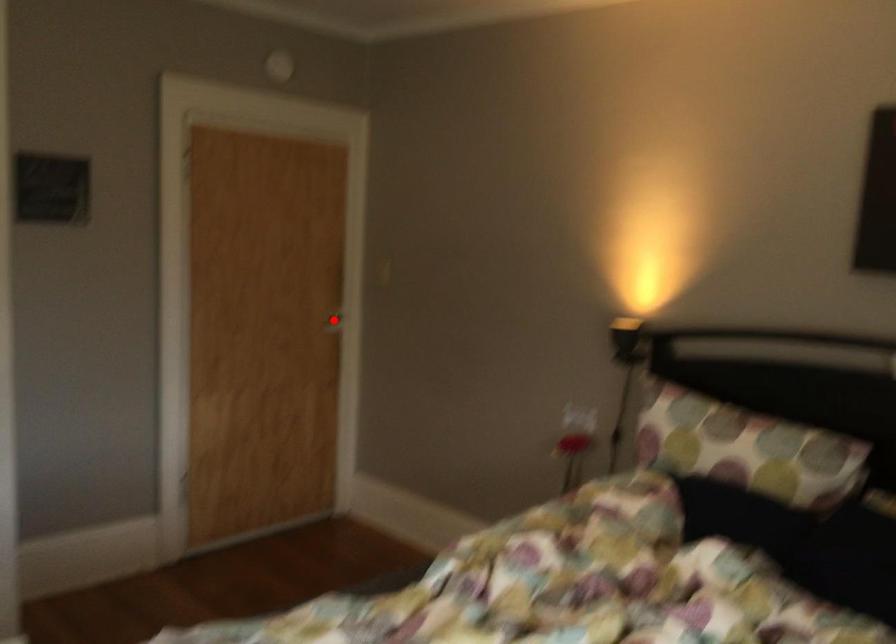
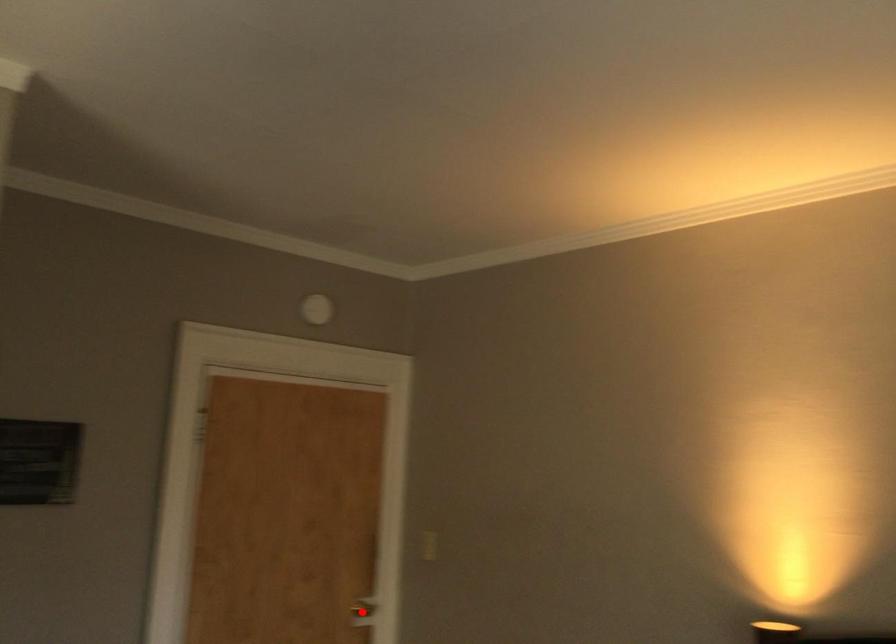
I am providing you with two images of the same scene from different viewpoints. A red point is marked on the first image and another point is marked on the second image. Is the red point in image1 aligned with the point shown in image2?

Yes